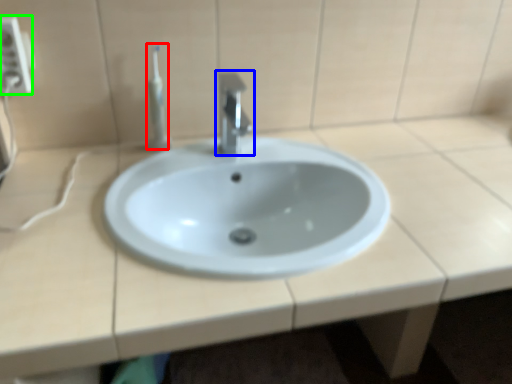
Question: Based on their relative distances, which object is nearer to toothbrush (highlighted by a red box)? Choose from tap (highlighted by a blue box) and electric outlet (highlighted by a green box).

Choices:
 (A) tap
 (B) electric outlet

Answer: (A)